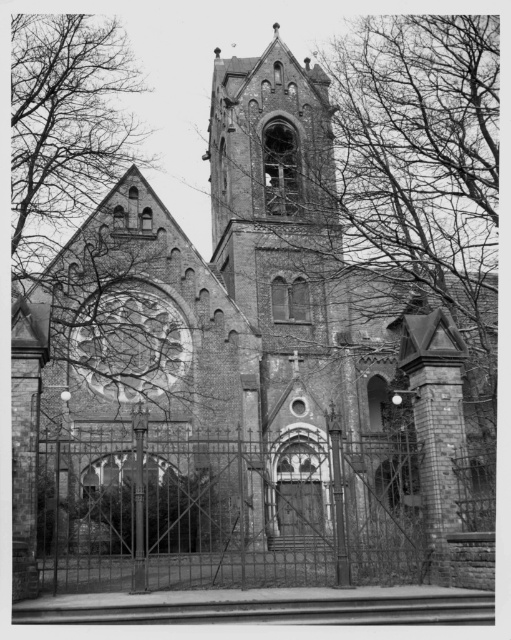
You are standing in front of the Gothic church and notice a point marked at coordinates (285, 515). What object is located at that point?

The iron gate at center is located at point (285, 515).

You are standing in front of the Gothic church and want to enter through the entrance. Which object, the iron gate at center or the bare branches at upper left, is closer to the main entrance of the church?

The iron gate at center is closer to the main entrance of the church because it is positioned to the right of the bare branches at upper left, indicating its placement near the entrance area.

You are standing in front of the Gothic church and want to enter through the entrance. Where is the entrance located relative to the iron gate at center?

The entrance is at the iron gate at center, which is located at point coordinates of (285, 515).